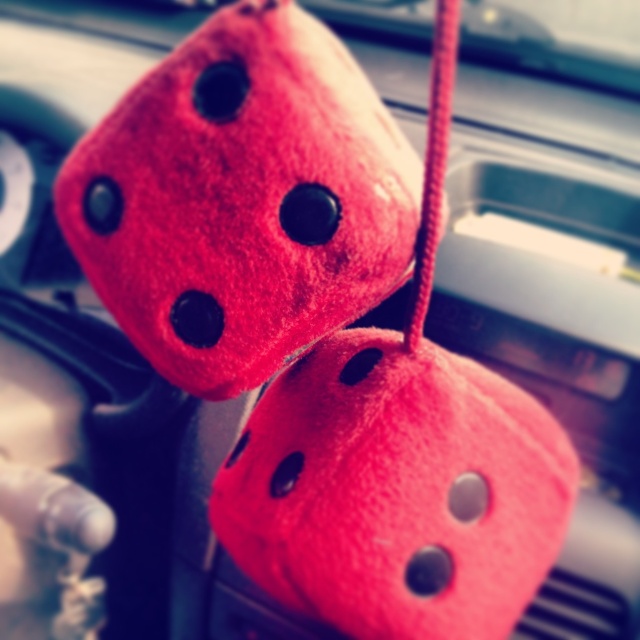
You are sitting in the driver seat of a car and notice a point in the image. The point is located at coordinates point (332,81). Based on the scene description, can you estimate how far this point is from your eyes?

The distance of point (332,81) from viewer is 18.51 inches.

You are sitting in the driver seat of a car and see two points hanging from the dashboard. The first point is at coordinates point (x=372, y=241) and the second point is at point (x=492, y=589). Which point is closer to you?

Point (x=372, y=241) is in front of point (x=492, y=589), so it is closer to you.